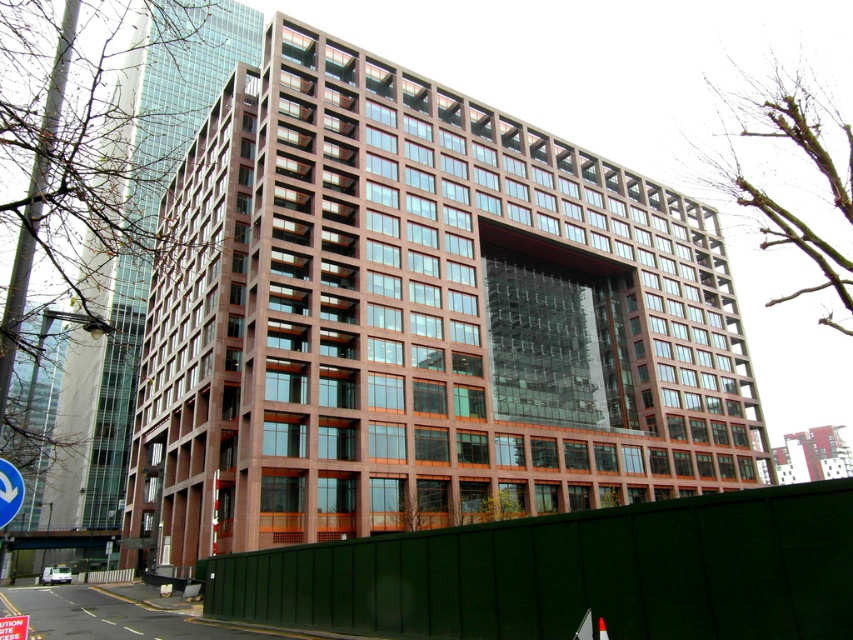
You are a delivery driver approaching the building and see the metallic silver arrow at center and the metallic reflective traffic sign at center in front of the building. Which object is narrower?

The metallic silver arrow at center is thinner than the metallic reflective traffic sign at center, so the metallic silver arrow at center is narrower.